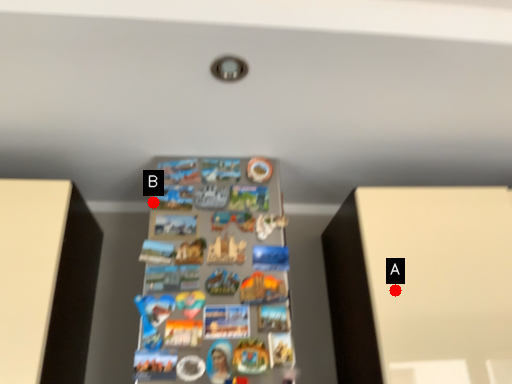
Question: Two points are circled on the image, labeled by A and B beside each circle. Which point appears closest to the camera in this image?

Choices:
 (A) A is closer
 (B) B is closer

Answer: (A)